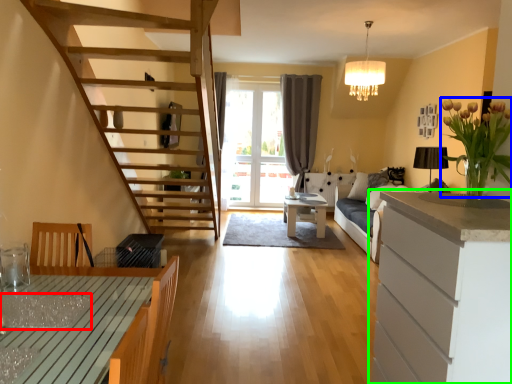
Question: Which is farther away from glass table (highlighted by a red box)? flower (highlighted by a blue box) or cabinetry (highlighted by a green box)?

Choices:
 (A) flower
 (B) cabinetry

Answer: (A)